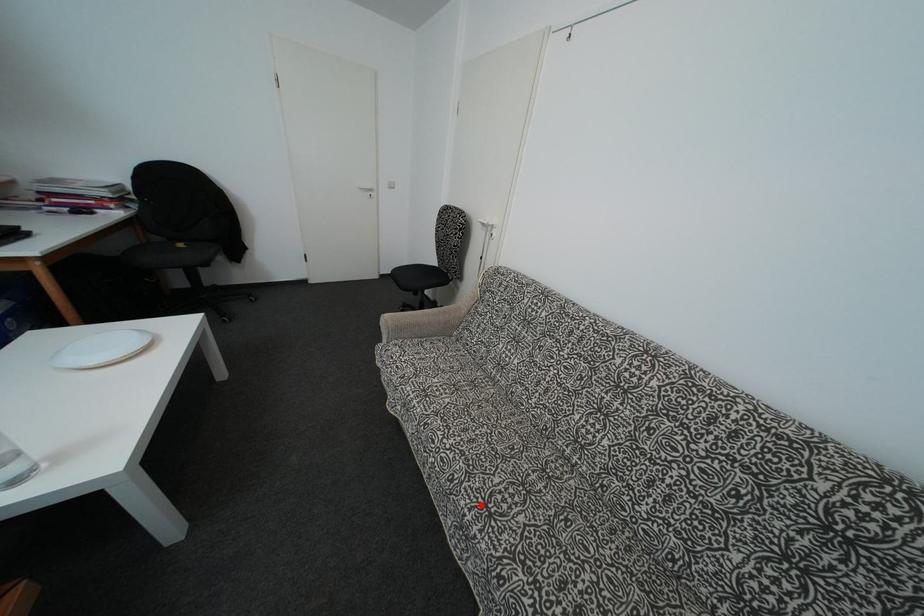
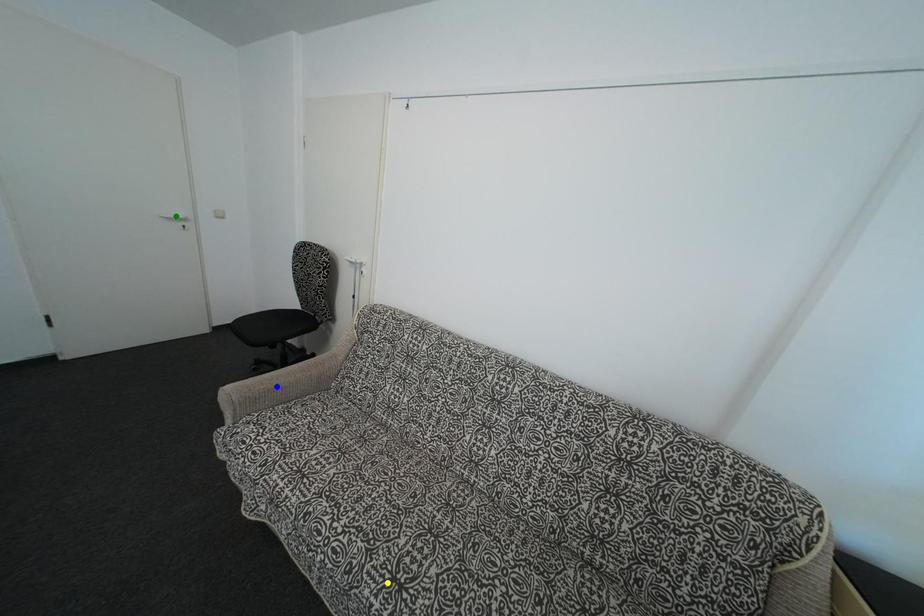
Question: I am providing you with two images of the same scene from different viewpoints. A red point is marked on the first image. You are given multiple points on the second image. Which spot in image 2 lines up with the point in image 1?

Choices:
 (A) yellow point
 (B) blue point
 (C) green point

Answer: (A)